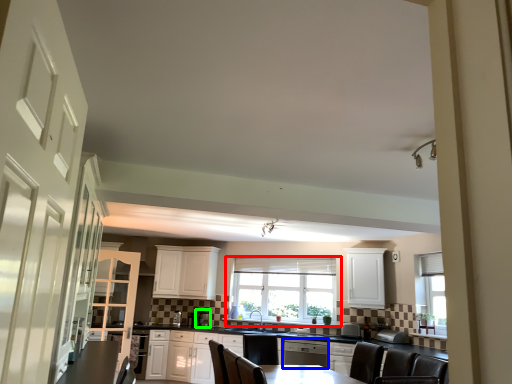
Question: Which object is positioned closest to window (highlighted by a red box)? Select from dish washer (highlighted by a blue box) and appliance (highlighted by a green box).

Choices:
 (A) dish washer
 (B) appliance

Answer: (B)